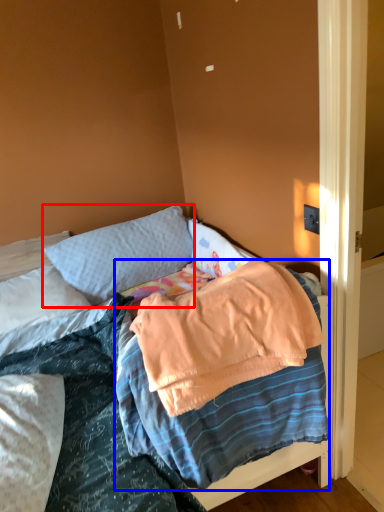
Question: Which point is closer to the camera, pillow (highlighted by a red box) or blanket (highlighted by a blue box)?

Choices:
 (A) pillow
 (B) blanket

Answer: (B)